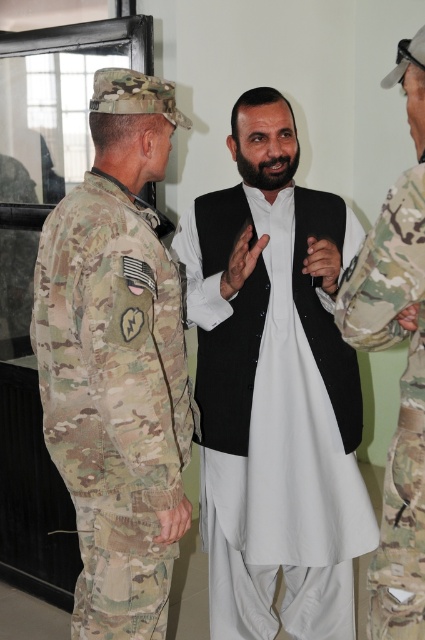
Looking at this image, you are a photographer trying to capture a candid shot of the camouflage fabric uniform at right and the matte black hand at center. Which one should you focus on first if you want to ensure both are in sharp focus?

The camouflage fabric uniform at right is closer to the viewer than the matte black hand at center, so you should focus on the camouflage fabric uniform at right first to ensure both are in sharp focus.

You are a photographer trying to capture a candid shot of the central figure in the scene. However, you notice two people blocking your view. Which object is closer to the central figure, the camouflage fabric uniform at right or the matte black hand at center?

The matte black hand at center is closer to the central figure because the camouflage fabric uniform at right is positioned on the right side of it, meaning the hand is in front.

You are standing at the point marked by the coordinate point (113, 400) in the image. What object is directly in front of you?

The point (113, 400) marks the camouflage fabric uniform at left, so the camouflage fabric uniform at left is directly in front of you.